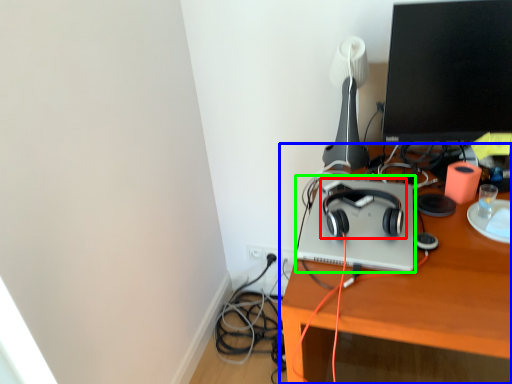
Question: Which object is positioned closest to headphones (highlighted by a red box)? Select from desk (highlighted by a blue box) and computer (highlighted by a green box).

Choices:
 (A) desk
 (B) computer

Answer: (B)